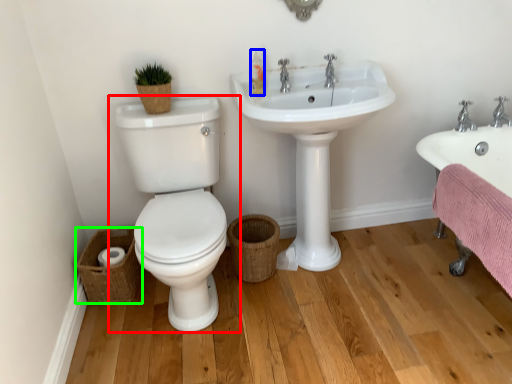
Question: Considering the real-world distances, which object is farthest from toilet (highlighted by a red box)? toiletry (highlighted by a blue box) or basket (highlighted by a green box)?

Choices:
 (A) toiletry
 (B) basket

Answer: (A)